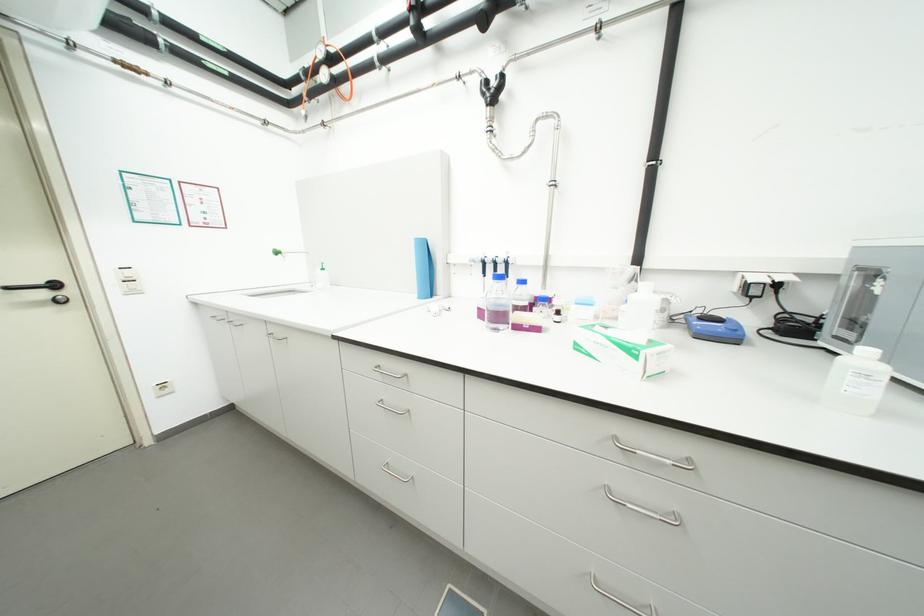
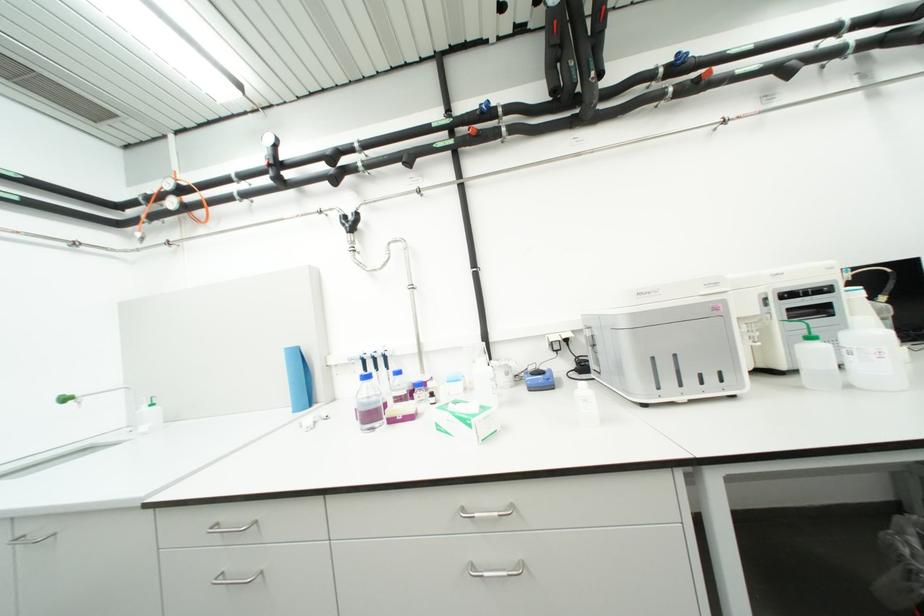
The point at (423, 297) is marked in the first image. Where is the corresponding point in the second image?

(298, 411)